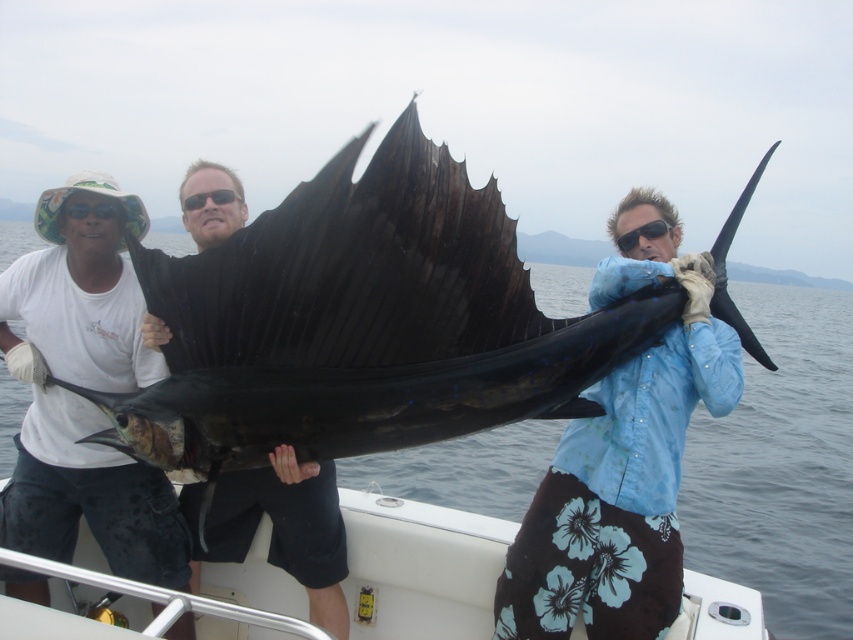
Identify the location of blue water at center. (781, 467).

Is point (785, 426) positioned in front of point (531, 618)?

No.

Identify the location of blue water at center. (781, 467).

Is point (418, 340) positioned behind point (575, 477)?

No, it is in front of (575, 477).

Is shiny black sailfish at center below blue fabric shirt at center?

Actually, shiny black sailfish at center is above blue fabric shirt at center.

Find the location of a particular element. The image size is (853, 640). shiny black sailfish at center is located at coordinates (363, 323).

Does shiny black sailfish at center appear over smooth black fish at center?

Yes, shiny black sailfish at center is above smooth black fish at center.

Who is taller, shiny black sailfish at center or smooth black fish at center?

Standing taller between the two is shiny black sailfish at center.

Which is in front, point (310, 314) or point (309, 467)?

Point (310, 314)

I want to click on shiny black sailfish at center, so click(x=363, y=323).